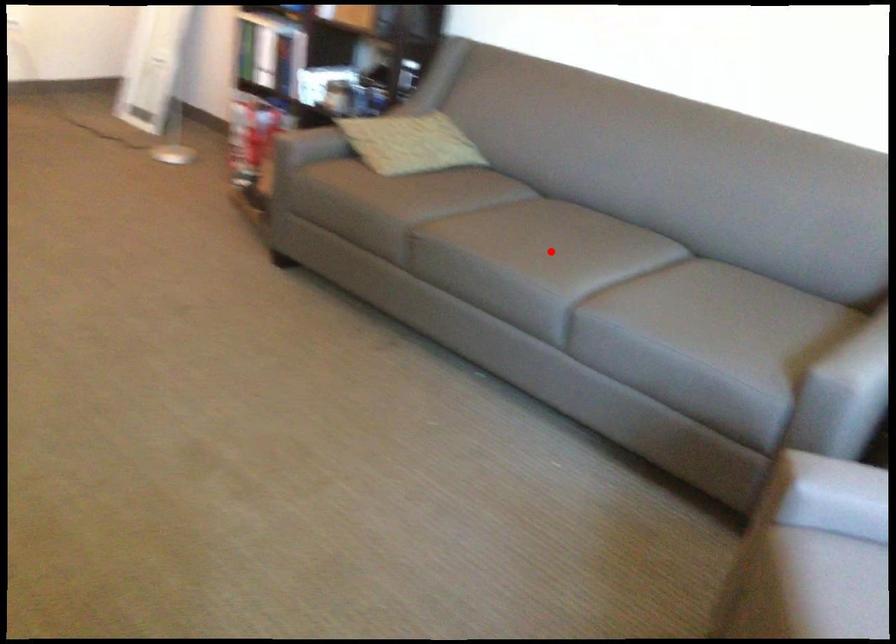
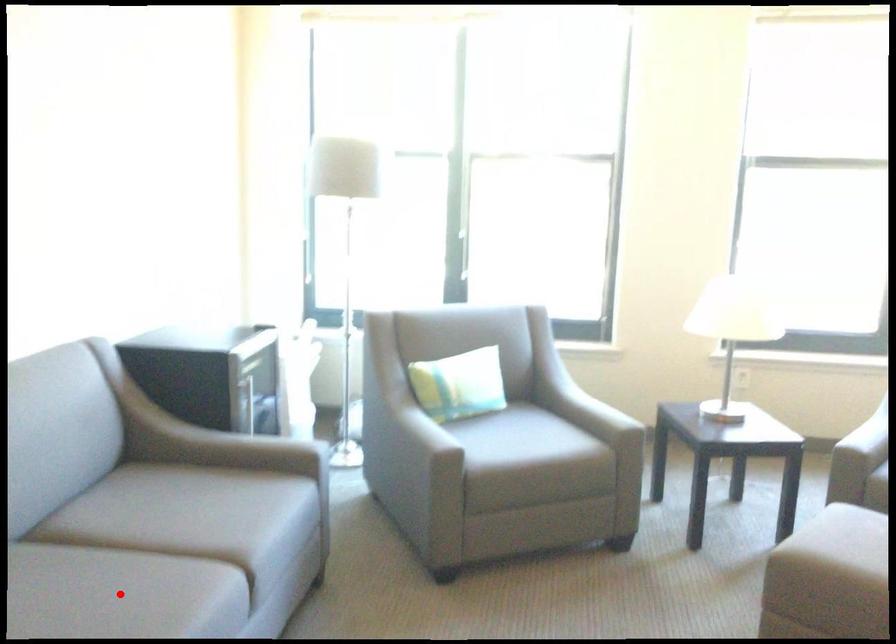
I am providing you with two images of the same scene from different viewpoints. A red point is marked on the first image and another point is marked on the second image. Does the point marked in image1 correspond to the same location as the one in image2?

Yes